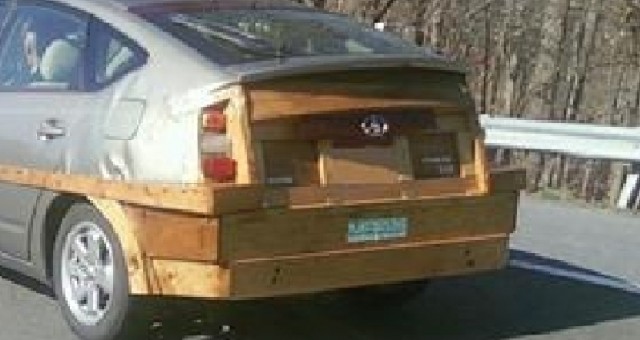
I want to click on window, so click(66, 54), click(129, 65).